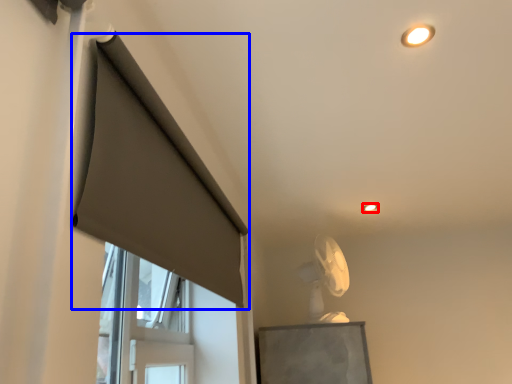
Question: Which object appears closest to the camera in this image, lighting (highlighted by a red box) or curtain (highlighted by a blue box)?

Choices:
 (A) lighting
 (B) curtain

Answer: (B)